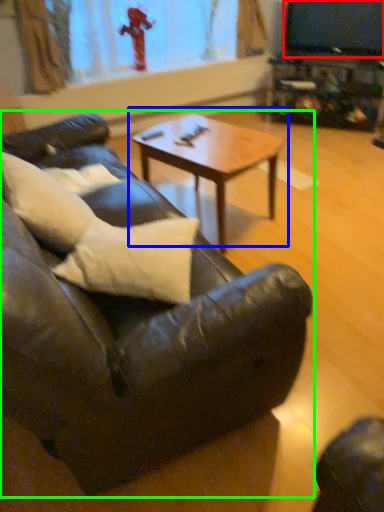
Question: Which object is the closest to the television (highlighted by a red box)? Choose among these: coffee table (highlighted by a blue box) or studio couch (highlighted by a green box).

Choices:
 (A) coffee table
 (B) studio couch

Answer: (A)